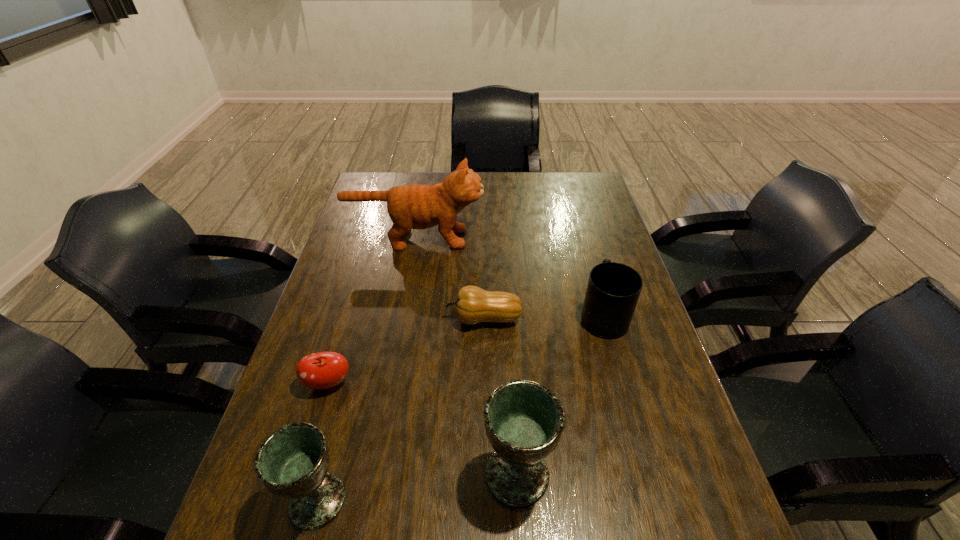
Please point out where to position a new chalice on the right to maintain spacing. Please provide its 2D coordinates. Your answer should be formatted as a tuple, i.e. [(x, y)], where the tuple contains the x and y coordinates of a point satisfying the conditions above.

[(701, 450)]